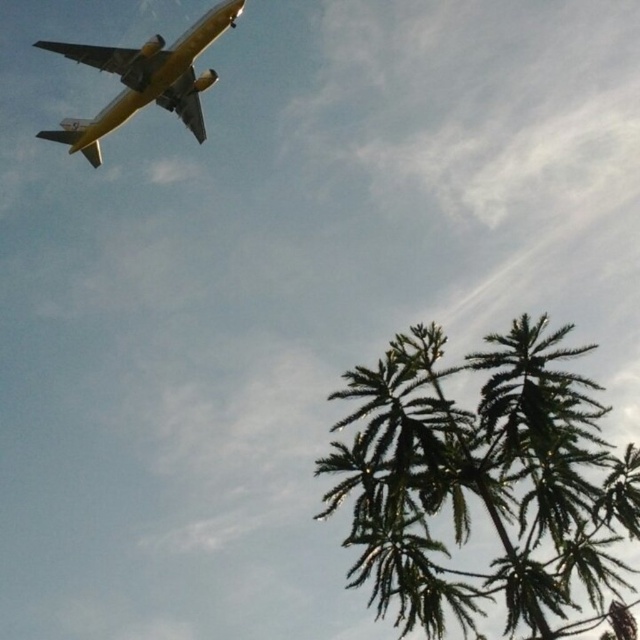
Consider the image. You are a pilot observing the yellow matte airplane at upper left and the green textured palm tree at lower right from the cockpit. Which object appears closer to you based on their sizes in the image?

The green textured palm tree at lower right appears closer because it is much taller than the yellow matte airplane at upper left in the image.

Looking at this image, you are a pilot flying a Boeing 737 and you notice a palm tree at a specific coordinate in your flight path. The coordinates are given as a point between 0 and 1, where 0 is the bottom left corner of your window. Your plane is at the upper left quadrant. Is the palm tree at point (x=484, y=486) in your window located to the right or left of your current position?

The green textured palm tree at lower right is located at point (x=484, y=486), which is to the right of the Boeing 737 in the upper left quadrant.

You are a drone operator flying a drone that is 1.5 meters wide. You want to capture a photo of the green textured palm tree at lower right. Can your drone safely fly between the airplane in the upper left and the palm tree without hitting either?

The distance between the green textured palm tree at lower right and the camera is 17.84 meters. Since the drone is 1.5 meters wide, it can safely fly between them as long as there is enough vertical clearance between the airplane and the palm tree. However, the exact vertical distance isn